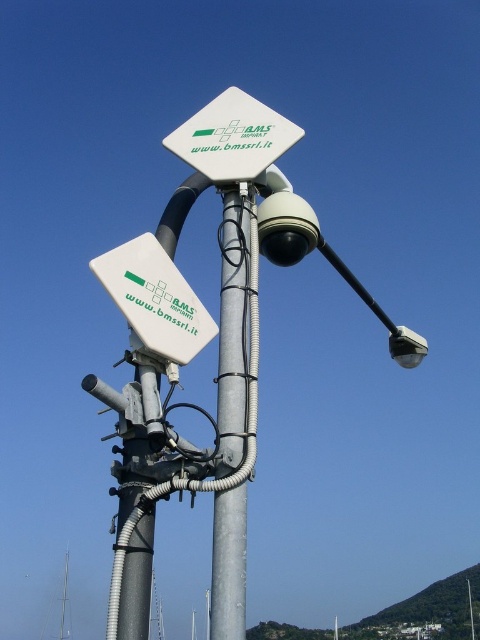
Who is lower down, white plastic lamp post at upper center or galvanized metal pole at center?

galvanized metal pole at center is below.

This screenshot has height=640, width=480. What do you see at coordinates (207, 342) in the screenshot?
I see `white plastic lamp post at upper center` at bounding box center [207, 342].

Who is more forward, (319, 228) or (216, 506)?

Point (216, 506)

This screenshot has height=640, width=480. In order to click on white plastic lamp post at upper center in this screenshot , I will do `click(207, 342)`.

Is white plastic lamp post at upper center further to the viewer compared to white plastic sign at center-left?

No.

Can you confirm if white plastic lamp post at upper center is smaller than white plastic sign at center-left?

No.

Is point (179, 208) more distant than point (194, 330)?

Yes, it is.

Where is `white plastic lamp post at upper center`? white plastic lamp post at upper center is located at coordinates (207, 342).

Does point (247, 413) come closer to viewer compared to point (180, 326)?

Yes.

At what (x,y) coordinates should I click in order to perform the action: click on galvanized metal pole at center. Please return your answer as a coordinate pair (x, y). Looking at the image, I should click on (233, 328).